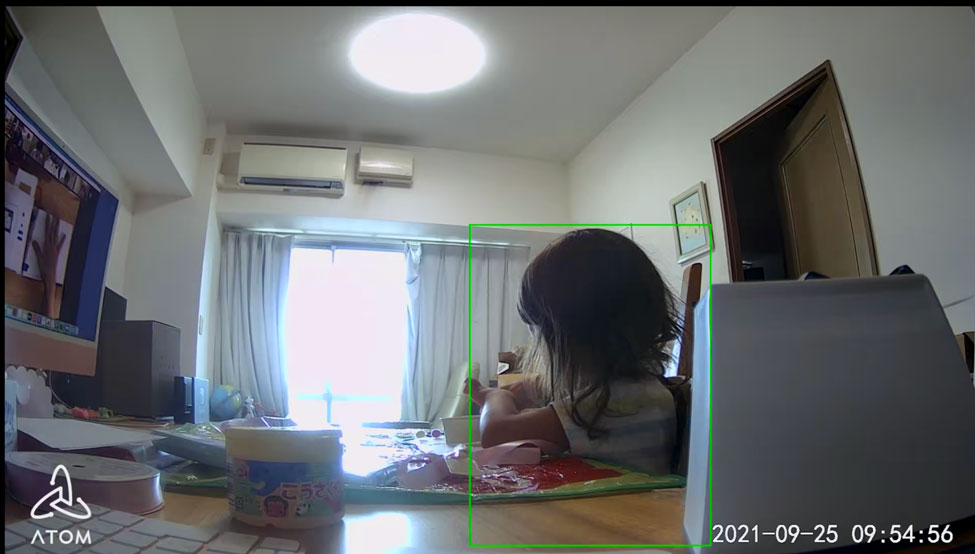
This screenshot has width=975, height=554. Identify the location of wooden desk. (405, 529), (626, 528).